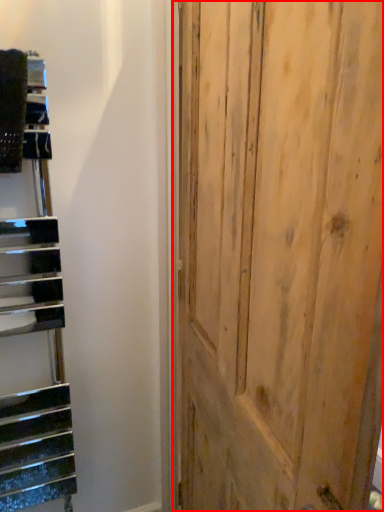
Question: Where is door (annotated by the red box) located in relation to stairwell in the image?

Choices:
 (A) left
 (B) right

Answer: (B)